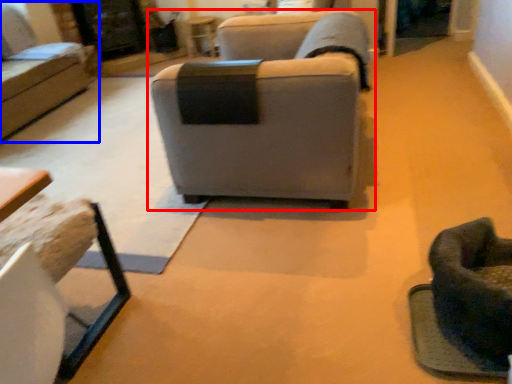
Question: Which point is closer to the camera, studio couch (highlighted by a red box) or studio couch (highlighted by a blue box)?

Choices:
 (A) studio couch
 (B) studio couch

Answer: (A)